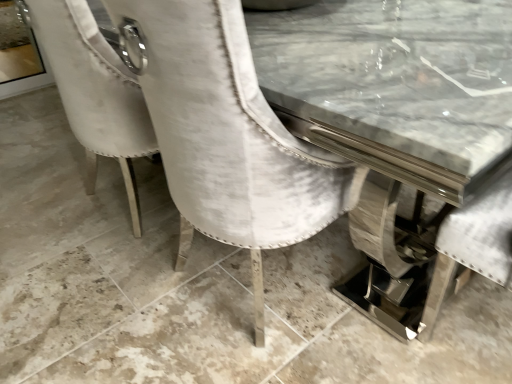
At what (x,y) coordinates should I click in order to perform the action: click on vacant space underneath velvet white chair at center (from a real-world perspective). Please return your answer as a coordinate pair (x, y). This screenshot has height=384, width=512. Looking at the image, I should click on (249, 280).